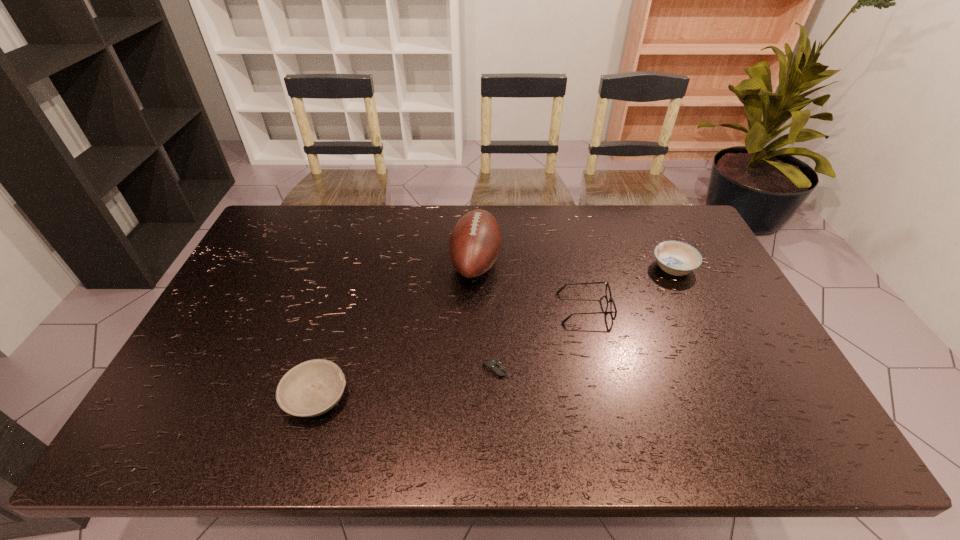
Locate an element on the screen. unoccupied position between the shortest object and the taller bowl is located at coordinates (585, 319).

Where is `free spot between the right bowl and the shorter bowl`? free spot between the right bowl and the shorter bowl is located at coordinates (494, 333).

This screenshot has height=540, width=960. Identify the location of vacant space that's between the tallest object and the shortest object. (486, 316).

Select which object is the closest to the second object from right to left. Please provide its 2D coordinates. Your answer should be formatted as a tuple, i.e. [(x, y)], where the tuple contains the x and y coordinates of a point satisfying the conditions above.

[(475, 242)]

Identify the location of the second closest object to the spectacles. This screenshot has width=960, height=540. (677, 258).

The height and width of the screenshot is (540, 960). What are the coordinates of `free location that satisfies the following two spatial constraints: 1. on the back side of the farther bowl; 2. on the right side of the shorter bowl` in the screenshot? It's located at (355, 268).